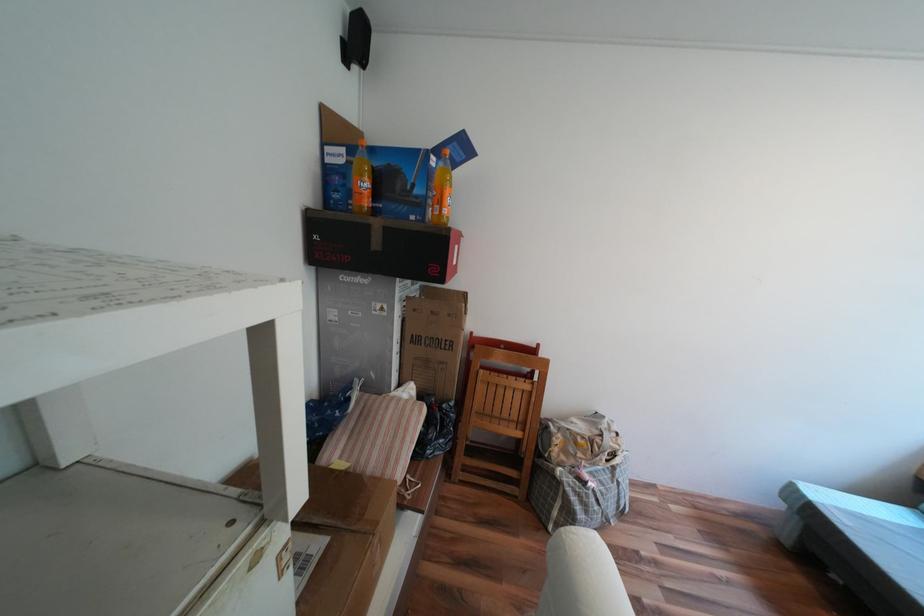
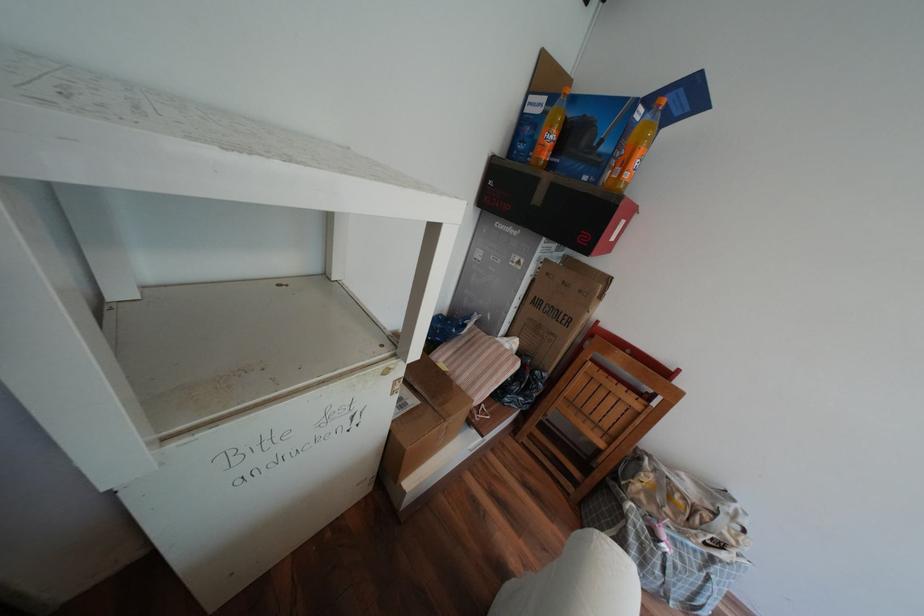
The point at (357,278) is marked in the first image. Where is the corresponding point in the second image?

(511, 225)